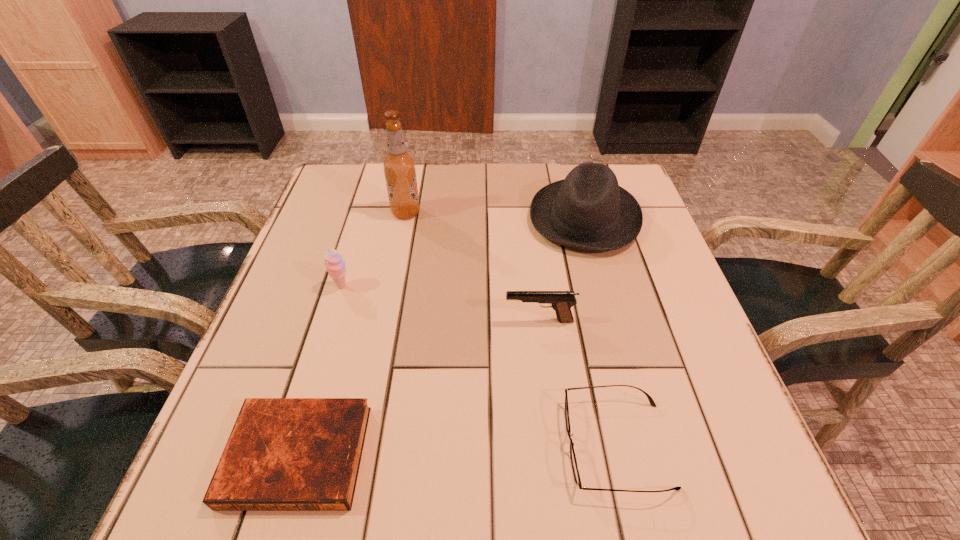
Find the location of a particular element. This screenshot has width=960, height=540. vacant space located on the back of the fourth nearest object is located at coordinates (363, 219).

This screenshot has width=960, height=540. I want to click on vacant space located at the muzzle of the pistol, so click(x=363, y=321).

The width and height of the screenshot is (960, 540). Find the location of `free space located at the muzzle of the pistol`. free space located at the muzzle of the pistol is located at coordinates (470, 321).

Locate an element on the screen. The width and height of the screenshot is (960, 540). free location located 0.330m at the muzzle of the pistol is located at coordinates (344, 321).

This screenshot has width=960, height=540. I want to click on free region located on the front-facing side of the spectacles, so click(455, 444).

At what (x,y) coordinates should I click in order to perform the action: click on free space located on the front-facing side of the spectacles. Please return your answer as a coordinate pair (x, y). Image resolution: width=960 pixels, height=540 pixels. Looking at the image, I should click on (522, 444).

Identify the location of free point located 0.150m on the front-facing side of the spectacles. (473, 444).

You are a GUI agent. You are given a task and a screenshot of the screen. Output one action in this format:
    pyautogui.click(x=<x>, y=<y>)
    Task: Click on the beer bottle located in the far edge section of the desktop
    
    Given the screenshot: What is the action you would take?
    pyautogui.click(x=399, y=166)

Locate an element on the screen. This screenshot has width=960, height=540. fedora situated at the far edge is located at coordinates (588, 210).

Where is `spectacles situated at the near edge`? spectacles situated at the near edge is located at coordinates (576, 474).